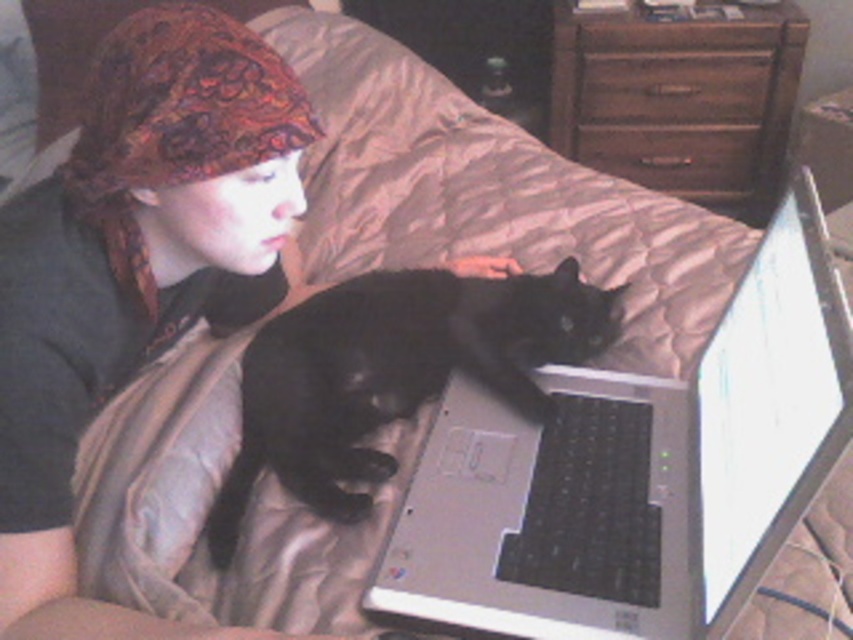
Is silver/black plastic laptop at center to the right of brown wood dresser at upper right from the viewer's perspective?

In fact, silver/black plastic laptop at center is to the left of brown wood dresser at upper right.

Where is `silver/black plastic laptop at center`? Image resolution: width=853 pixels, height=640 pixels. silver/black plastic laptop at center is located at coordinates (636, 472).

At what (x,y) coordinates should I click in order to perform the action: click on silver/black plastic laptop at center. Please return your answer as a coordinate pair (x, y). The width and height of the screenshot is (853, 640). Looking at the image, I should click on (636, 472).

Which is below, brown wood dresser at upper right or brown wood drawer at center?

brown wood drawer at center

Locate an element on the screen. The image size is (853, 640). brown wood dresser at upper right is located at coordinates (680, 99).

Can you confirm if black fur cat at center is smaller than brown wood drawer at center?

No.

Who is shorter, black fur cat at center or brown wood drawer at center?

brown wood drawer at center

Is point (300, 348) closer to viewer compared to point (653, 128)?

Yes.

Locate an element on the screen. This screenshot has height=640, width=853. black fur cat at center is located at coordinates (393, 372).